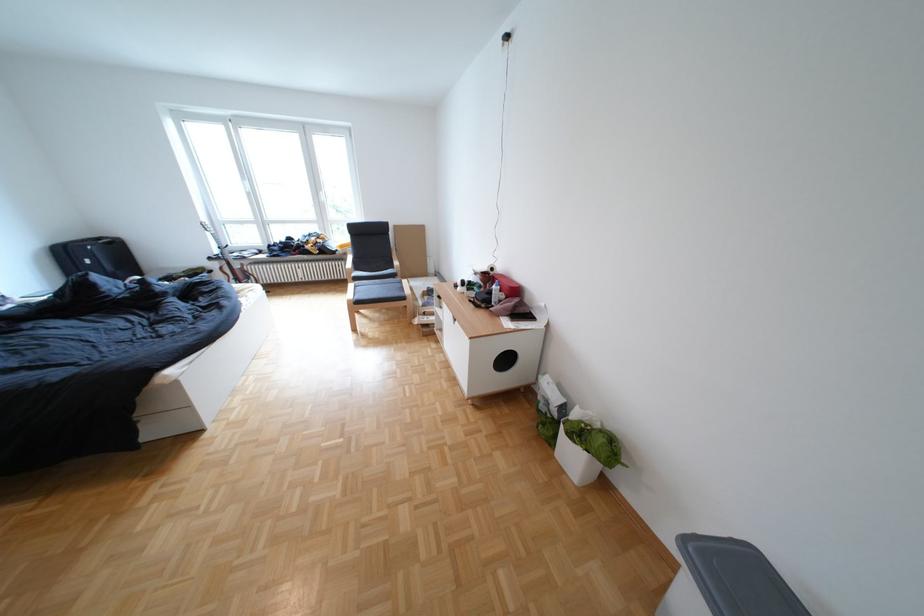
Where would you lift the grey bin lid? Please return your answer as a coordinate pair (x, y).

(736, 578)